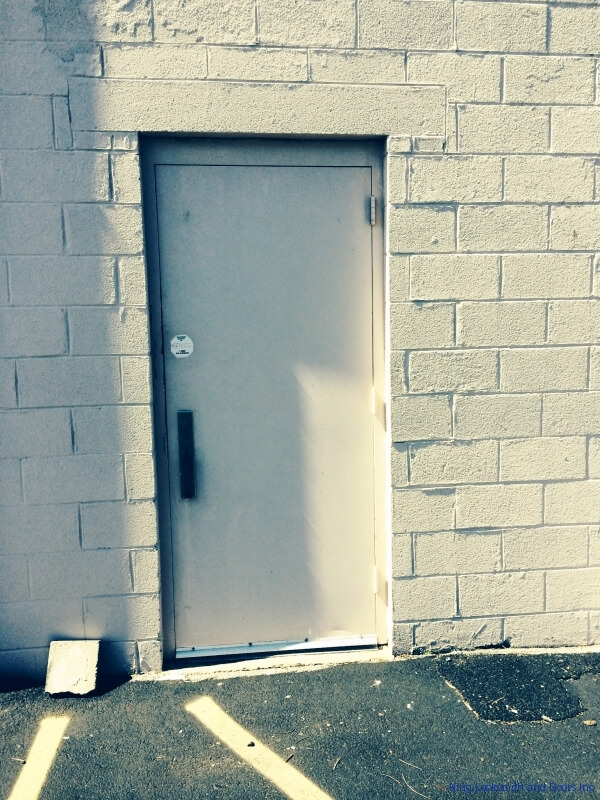
At what (x,y) coordinates should I click in order to perform the action: click on middle hinge. Please return your answer as a coordinate pair (x, y). The width and height of the screenshot is (600, 800). Looking at the image, I should click on (372, 402).